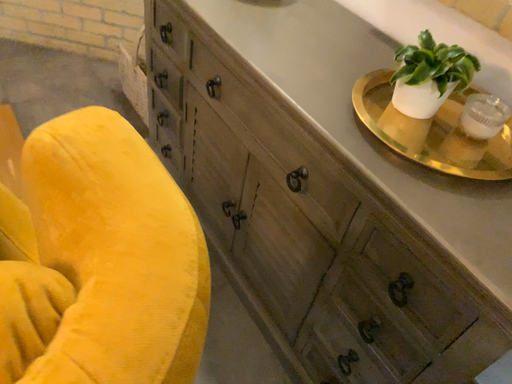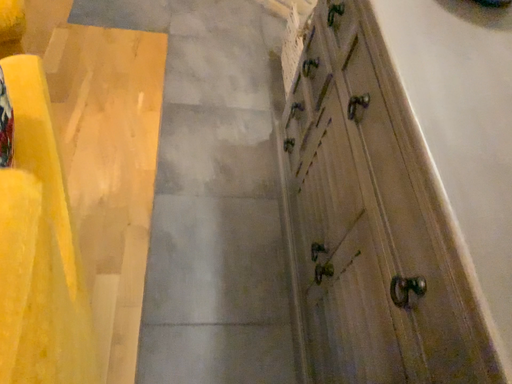
Question: How did the camera likely rotate when shooting the video?

Choices:
 (A) rotated right
 (B) rotated left

Answer: (B)